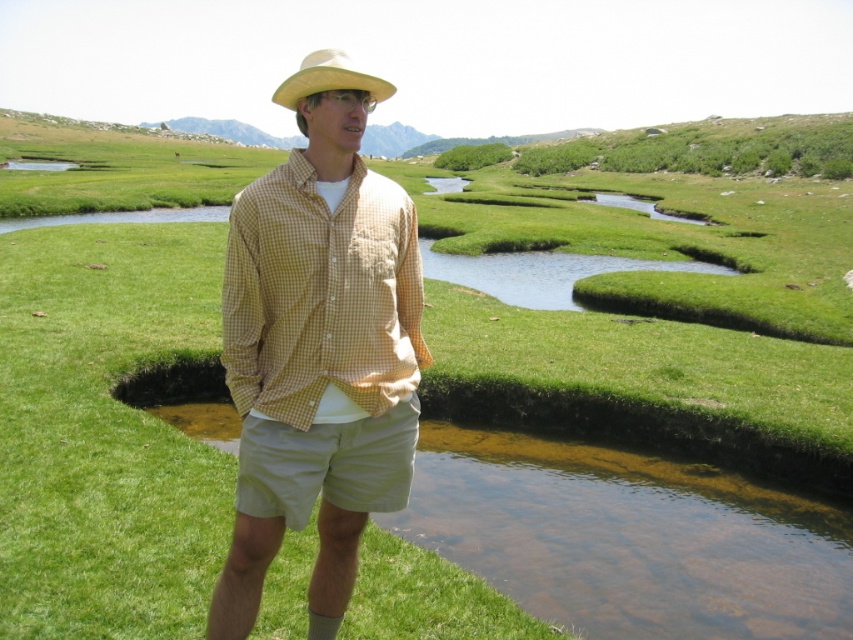
Question: Which point is closer to the camera taking this photo?

Choices:
 (A) (283, 438)
 (B) (340, 291)
 (C) (328, 90)
 (D) (296, 339)

Answer: (C)

Question: Does matte yellow hat at center lie in front of yellow checkered shirt at center?

Choices:
 (A) yes
 (B) no

Answer: (A)

Question: Can you confirm if matte yellow hat at center is thinner than yellow straw hat at upper center?

Choices:
 (A) no
 (B) yes

Answer: (B)

Question: Which object is the farthest from the yellow checkered shirt at center?

Choices:
 (A) matte yellow hat at center
 (B) khaki cotton shorts at center

Answer: (B)

Question: Which point is farther to the camera?

Choices:
 (A) (236, 406)
 (B) (399, 504)
 (C) (274, 230)

Answer: (A)

Question: Can you confirm if yellow checkered shirt at center is bigger than yellow straw hat at upper center?

Choices:
 (A) yes
 (B) no

Answer: (B)